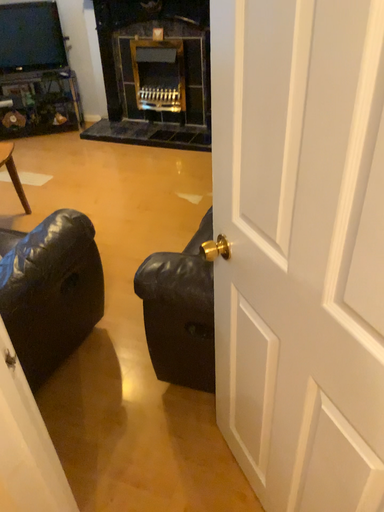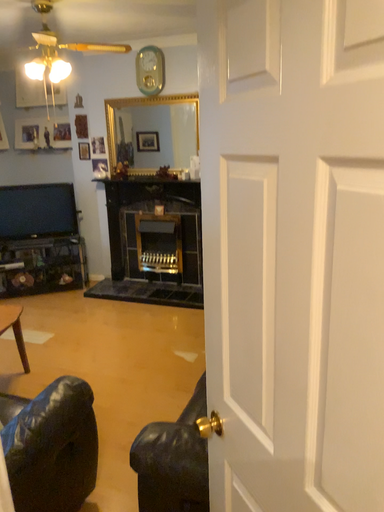
Question: Which way did the camera rotate in the video?

Choices:
 (A) rotated upward
 (B) rotated downward

Answer: (A)